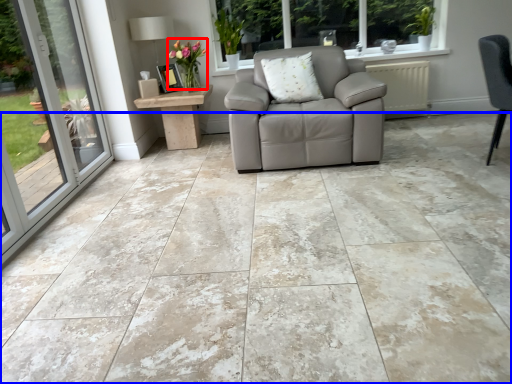
Question: Which object is closer to the camera taking this photo, flower (highlighted by a red box) or concrete (highlighted by a blue box)?

Choices:
 (A) flower
 (B) concrete

Answer: (B)